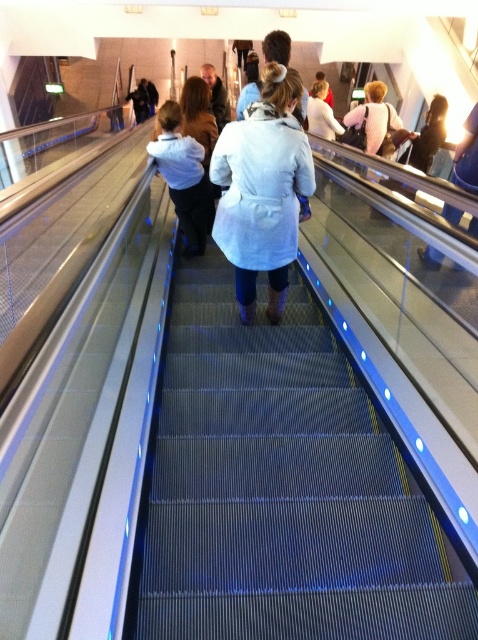
Based on the photo, is light blue denim jacket at center closer to the viewer compared to dark blue jacket at upper center?

Yes, light blue denim jacket at center is closer to the viewer.

Is light blue denim jacket at center bigger than dark blue jacket at upper center?

Correct, light blue denim jacket at center is larger in size than dark blue jacket at upper center.

Does point (172, 163) come behind point (145, 113)?

No.

Locate an element on the screen. The image size is (478, 640). light blue denim jacket at center is located at coordinates (x=183, y=177).

Who is higher up, light brown leather jacket at upper center or light brown leather jacket at center?

light brown leather jacket at center

Who is more distant from viewer, (381, 90) or (215, 77)?

The point (215, 77) is behind.

Locate an element on the screen. The width and height of the screenshot is (478, 640). light brown leather jacket at upper center is located at coordinates (373, 115).

Is point (201, 156) closer to camera compared to point (323, 131)?

Yes, point (201, 156) is closer to viewer.

Based on the photo, can you confirm if light blue denim jacket at center is positioned above white matte coat at upper center?

Actually, light blue denim jacket at center is below white matte coat at upper center.

What do you see at coordinates (183, 177) in the screenshot? The image size is (478, 640). I see `light blue denim jacket at center` at bounding box center [183, 177].

Find the location of a particular element. This screenshot has width=478, height=640. light blue denim jacket at center is located at coordinates (183, 177).